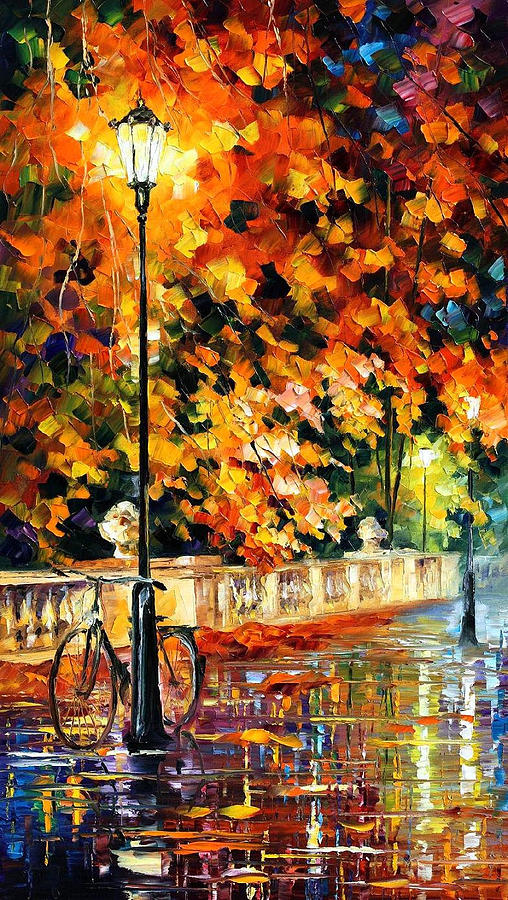
Locate an element on the screen. sculpture is located at coordinates (119, 525), (368, 528).